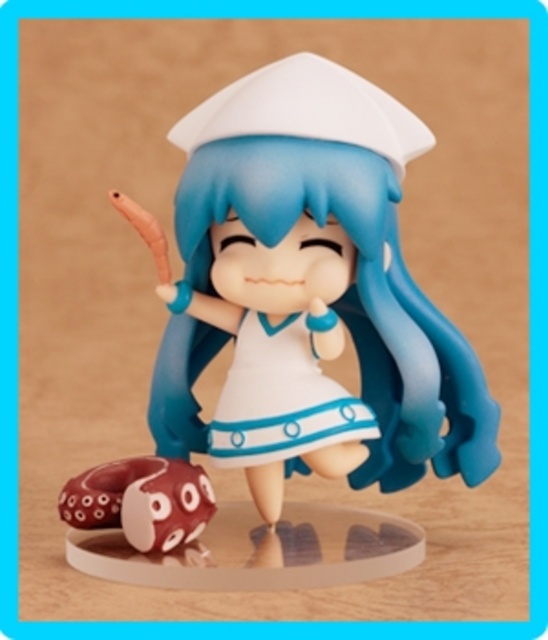
Question: Which of the following is the closest to the observer?

Choices:
 (A) coord(408,312)
 (B) coord(162,520)

Answer: (B)

Question: Which object appears closest to the camera in this image?

Choices:
 (A) matte plastic figure at center
 (B) white glossy dress at center

Answer: (A)

Question: Which is farther from the matte brown octopus at lower left?

Choices:
 (A) white glossy dress at center
 (B) matte plastic figure at center

Answer: (B)

Question: Can you confirm if matte plastic figure at center is bigger than white glossy dress at center?

Choices:
 (A) yes
 (B) no

Answer: (A)

Question: Does matte plastic figure at center appear under matte brown octopus at lower left?

Choices:
 (A) yes
 (B) no

Answer: (B)

Question: Where is white glossy dress at center located in relation to matte brown octopus at lower left in the image?

Choices:
 (A) right
 (B) left

Answer: (A)